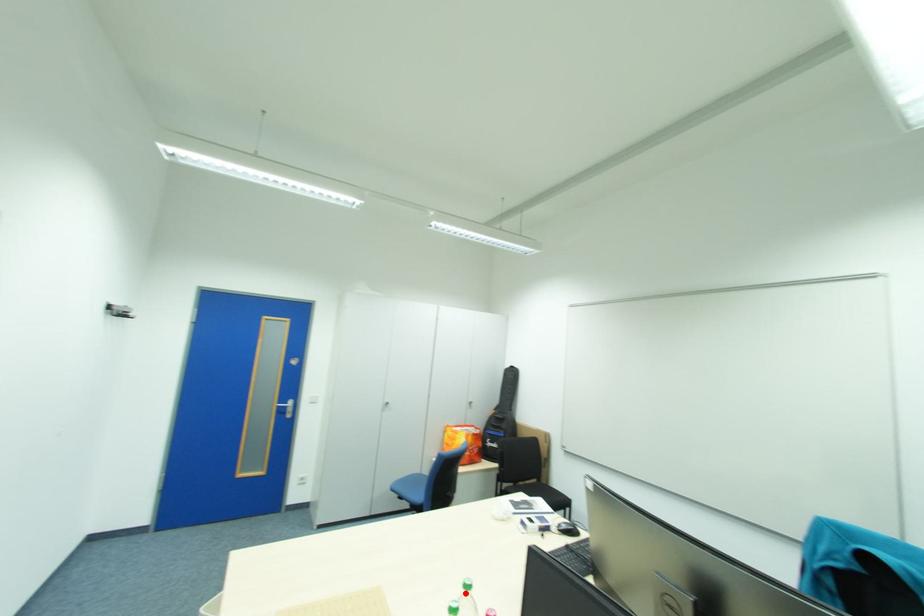
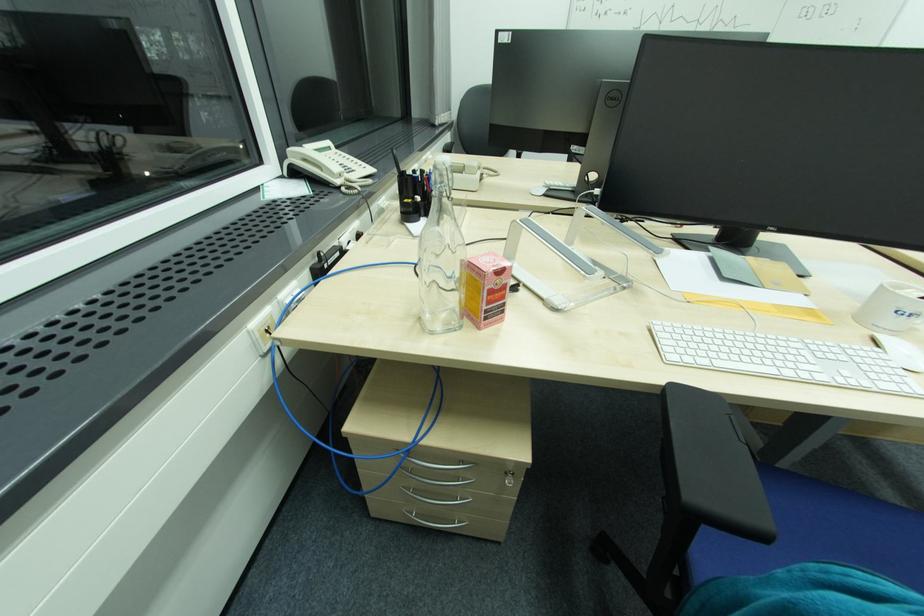
Question: I am providing you with two images of the same scene from different viewpoints. A red point is marked on the first image. Is the red point's position out of view in image 2?

Choices:
 (A) Yes
 (B) No

Answer: (A)